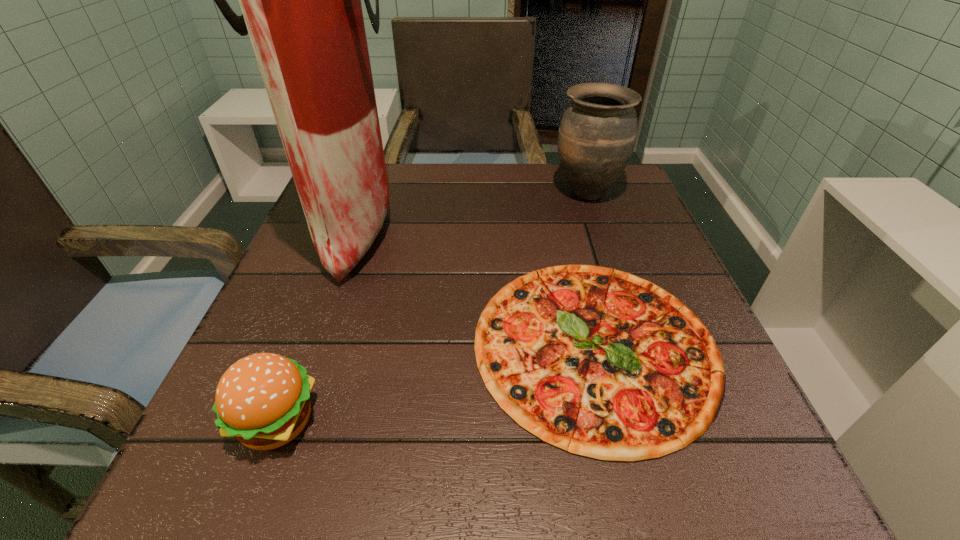
I want to click on vacant area at the far edge, so click(x=468, y=206).

Where is `vacant region at the near edge`? The width and height of the screenshot is (960, 540). vacant region at the near edge is located at coordinates (327, 478).

The image size is (960, 540). I want to click on vacant space at the left edge, so click(x=276, y=348).

Where is `vacant space at the near left corner`? vacant space at the near left corner is located at coordinates (255, 467).

At what (x,y) coordinates should I click in order to perform the action: click on free point at the far right corner. Please return your answer as a coordinate pair (x, y). Image resolution: width=960 pixels, height=540 pixels. Looking at the image, I should click on (622, 205).

In the image, there is a desktop. Where is `vacant region at the near right corner`? The image size is (960, 540). vacant region at the near right corner is located at coordinates (738, 462).

The image size is (960, 540). I want to click on blank region between the tallest object and the hamburger, so click(x=317, y=324).

I want to click on blank region between the hamburger and the third shortest object, so click(x=432, y=306).

This screenshot has width=960, height=540. Identify the location of empty space that is in between the third tallest object and the pizza. (437, 382).

Where is `free space between the second tallest object and the hamburger`? The height and width of the screenshot is (540, 960). free space between the second tallest object and the hamburger is located at coordinates (432, 306).